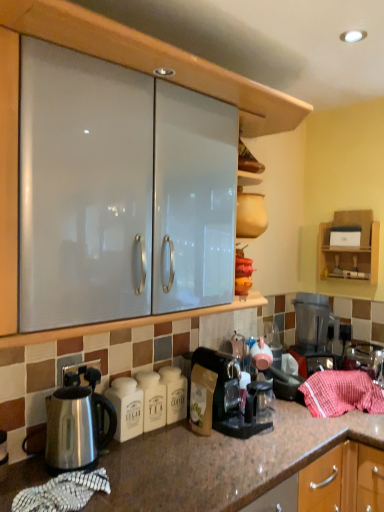
Question: Which direction should I rotate to look at transparent plastic coffee maker at lower center, which is the 2th coffee maker in back-to-front order, — up or down?

Choices:
 (A) down
 (B) up

Answer: (A)

Question: Is white ceramic sugar container at lower left located outside wooden shelf at upper right?

Choices:
 (A) no
 (B) yes

Answer: (B)

Question: Can you confirm if white ceramic sugar container at lower left is positioned to the right of wooden shelf at upper right?

Choices:
 (A) yes
 (B) no

Answer: (B)

Question: Considering the relative sizes of white ceramic sugar container at lower left and wooden shelf at upper right in the image provided, is white ceramic sugar container at lower left bigger than wooden shelf at upper right?

Choices:
 (A) yes
 (B) no

Answer: (B)

Question: Would you say white ceramic sugar container at lower left is a long distance from wooden shelf at upper right?

Choices:
 (A) no
 (B) yes

Answer: (B)

Question: Does white ceramic sugar container at lower left touch wooden shelf at upper right?

Choices:
 (A) yes
 (B) no

Answer: (B)

Question: Considering the relative sizes of white ceramic sugar container at lower left and wooden shelf at upper right in the image provided, is white ceramic sugar container at lower left taller than wooden shelf at upper right?

Choices:
 (A) yes
 (B) no

Answer: (B)

Question: Is black plastic coffee maker at right, positioned as the first coffee maker in right-to-left order, to the right of white ceramic sugar container at lower left from the viewer's perspective?

Choices:
 (A) no
 (B) yes

Answer: (B)

Question: Is black plastic coffee maker at right, positioned as the first coffee maker in right-to-left order, not inside white ceramic sugar container at lower left?

Choices:
 (A) no
 (B) yes

Answer: (B)

Question: Is there a large distance between black plastic coffee maker at right, which is the first coffee maker in back-to-front order, and white ceramic sugar container at lower left?

Choices:
 (A) no
 (B) yes

Answer: (A)

Question: From the image's perspective, is black plastic coffee maker at right, which is the first coffee maker in back-to-front order, below white ceramic sugar container at lower left?

Choices:
 (A) no
 (B) yes

Answer: (A)

Question: Is black plastic coffee maker at right, which is the first coffee maker in back-to-front order, shorter than white ceramic sugar container at lower left?

Choices:
 (A) no
 (B) yes

Answer: (A)

Question: From a real-world perspective, is black plastic coffee maker at right, positioned as the first coffee maker in right-to-left order, over white ceramic sugar container at lower left?

Choices:
 (A) yes
 (B) no

Answer: (A)

Question: Considering the relative sizes of transparent plastic coffee maker at lower center, which is the 2th coffee maker in back-to-front order, and white ceramic sugar container at lower left in the image provided, is transparent plastic coffee maker at lower center, which is the 2th coffee maker in back-to-front order, thinner than white ceramic sugar container at lower left?

Choices:
 (A) yes
 (B) no

Answer: (B)